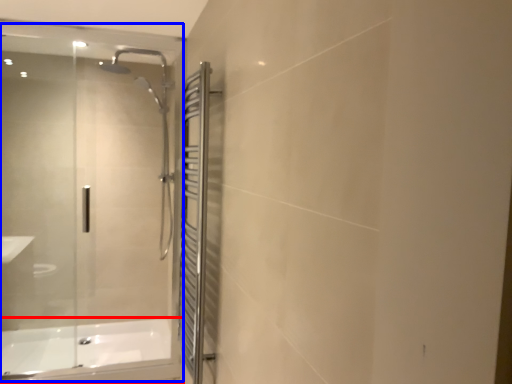
Question: Which object is closer to the camera taking this photo, bathtub (highlighted by a red box) or glass door (highlighted by a blue box)?

Choices:
 (A) bathtub
 (B) glass door

Answer: (B)